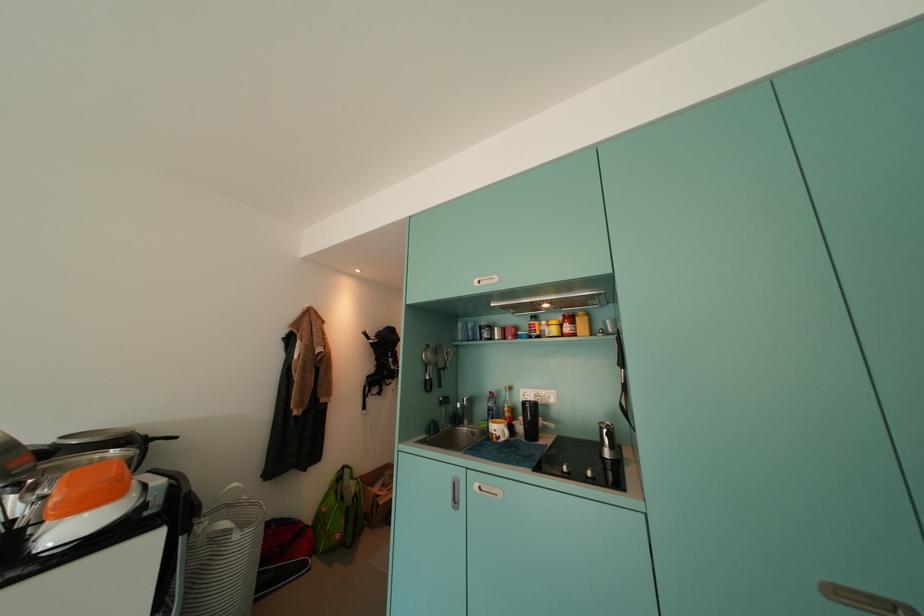
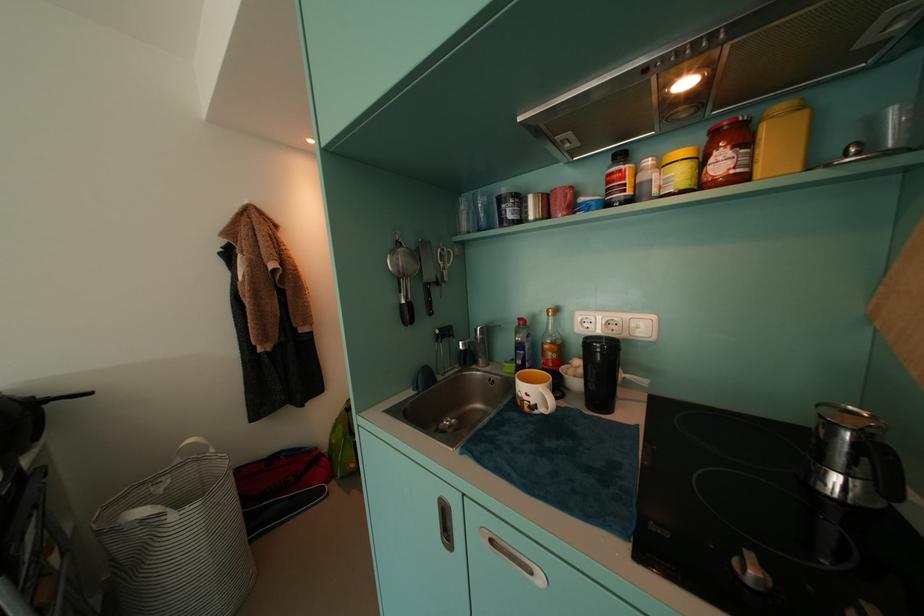
Locate, in the second image, the point that corresponds to [609,432] in the first image.

(837, 429)